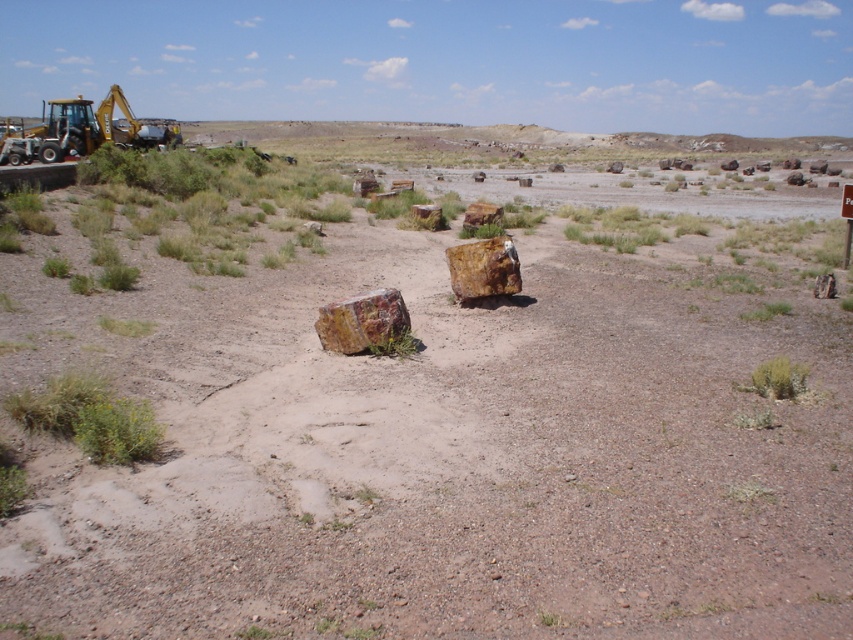
Between brown textured rock at center and yellow-green metal excavator at upper left, which one is positioned lower?

Positioned lower is brown textured rock at center.

Is brown textured rock at center below yellow-green metal excavator at upper left?

Indeed, brown textured rock at center is positioned under yellow-green metal excavator at upper left.

Is point (244, 390) less distant than point (20, 163)?

Yes, it is in front of point (20, 163).

I want to click on brown textured rock at center, so click(425, 440).